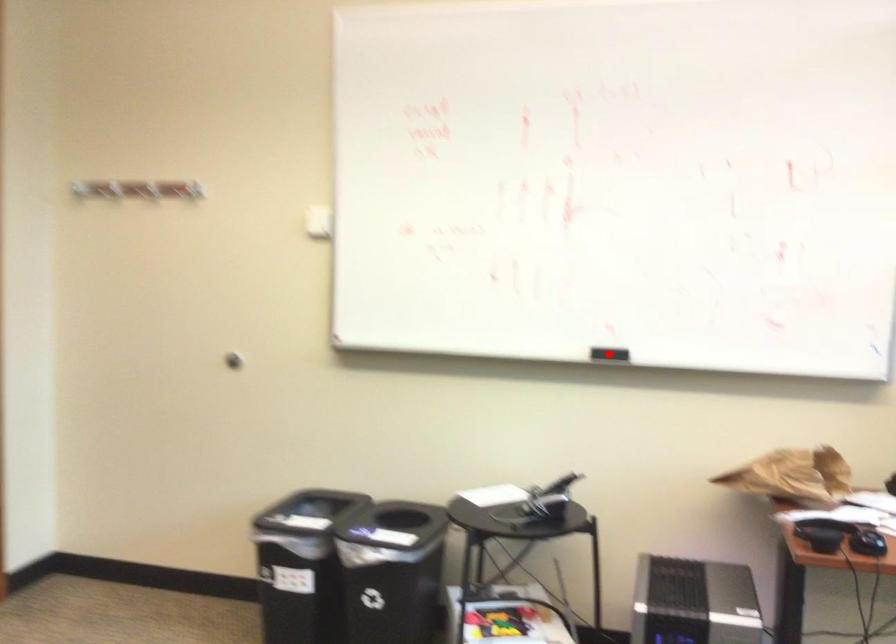
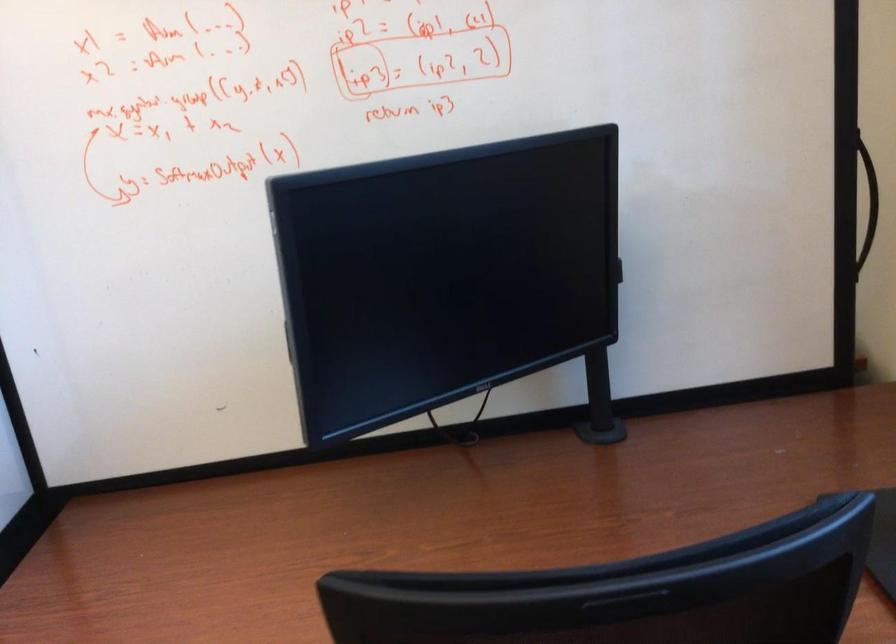
Question: I am providing you with two images of the same scene from different viewpoints. A red point is marked on the first image. Is the red point's position out of view in image 2?

Choices:
 (A) Yes
 (B) No

Answer: (A)